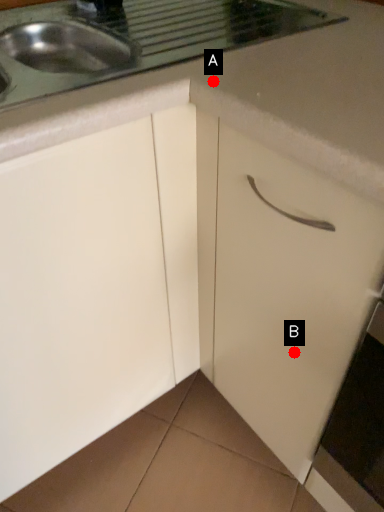
Question: Two points are circled on the image, labeled by A and B beside each circle. Which point is farther to the camera?

Choices:
 (A) A is further
 (B) B is further

Answer: (B)